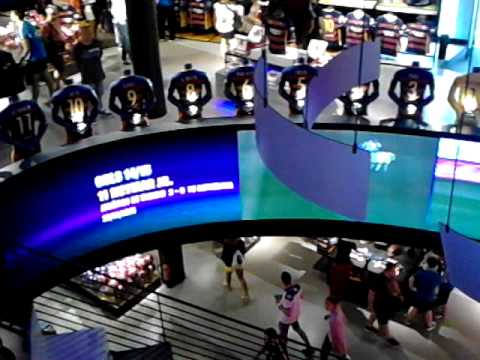
You are a GUI agent. You are given a task and a screenshot of the screen. Output one action in this format:
    pyautogui.click(x=<x>, y=<y>)
    Task: Click on the floor
    The width and height of the screenshot is (480, 360).
    Given the screenshot: What is the action you would take?
    277,258, 191,286, 204,255, 195,49, 382,97